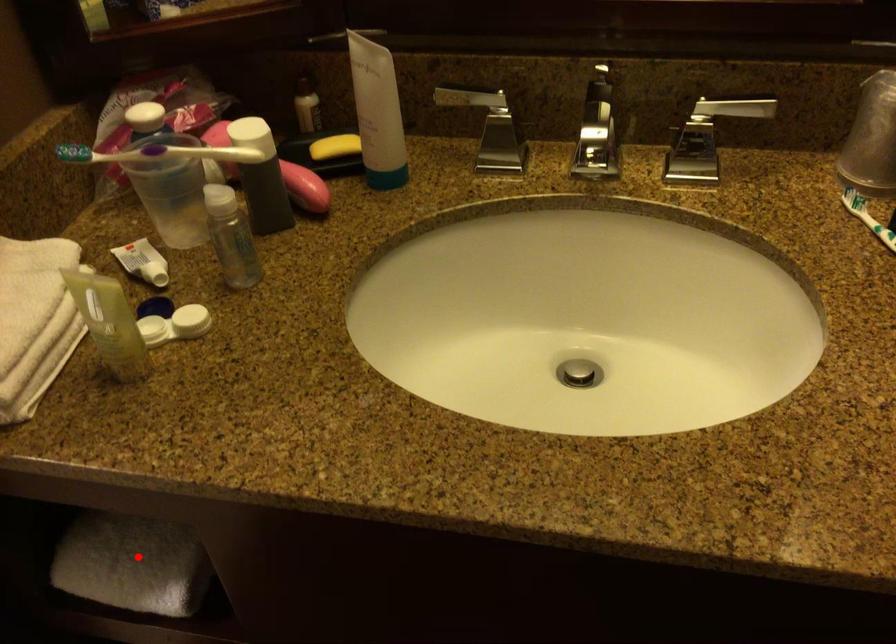
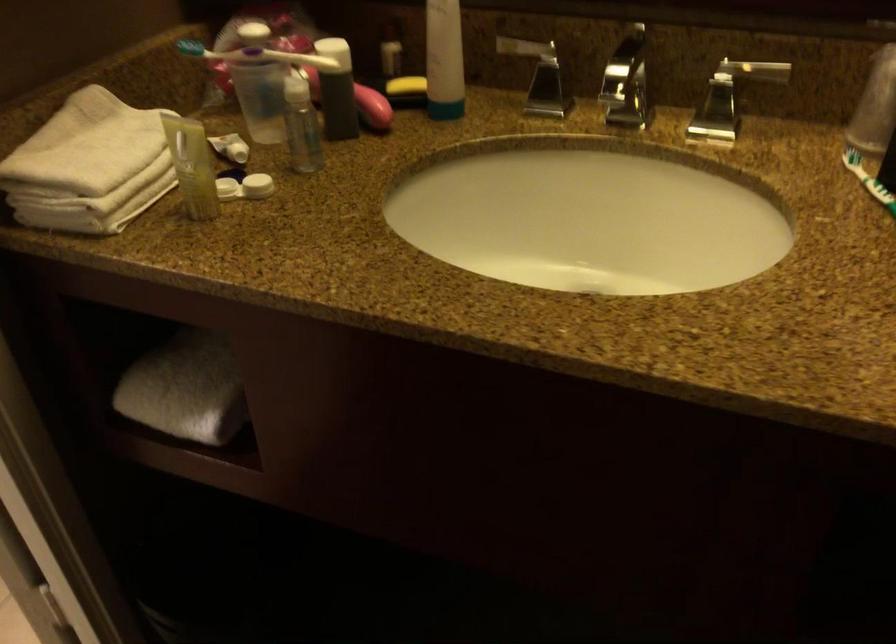
Question: I am providing you with two images of the same scene from different viewpoints. Image1 has a red point marked. In image2, the corresponding 3D location appears at what relative position? Reply with the corresponding letter.

Choices:
 (A) Closer
 (B) Farther

Answer: (B)